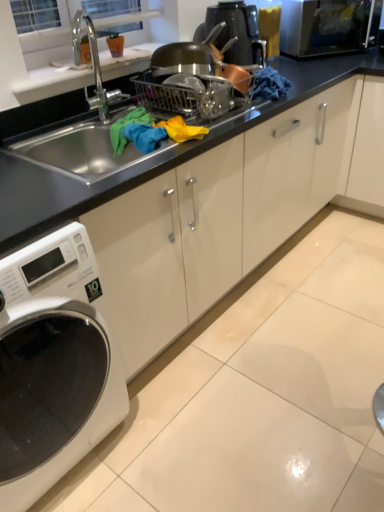
Question: In terms of height, does black glass microwave at upper right look taller or shorter compared to black glossy coffee machine at upper center?

Choices:
 (A) tall
 (B) short

Answer: (B)

Question: From a real-world perspective, relative to black glossy coffee machine at upper center, is black glass microwave at upper right vertically above or below?

Choices:
 (A) below
 (B) above

Answer: (A)

Question: Estimate the real-world distances between objects in this image. Which object is closer to the white glossy washing machine at lower left?

Choices:
 (A) black glass microwave at upper right
 (B) black glossy coffee machine at upper center
 (C) black matte sink at center

Answer: (C)

Question: Which of these objects is positioned closest to the white glossy washing machine at lower left?

Choices:
 (A) black glossy coffee machine at upper center
 (B) black matte sink at center
 (C) black glass microwave at upper right

Answer: (B)